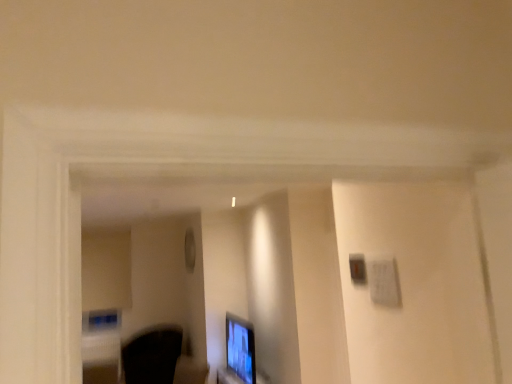
Question: From the image's perspective, is matte black monitor at lower center located above or below black fabric swivel chair at lower left?

Choices:
 (A) below
 (B) above

Answer: (B)

Question: Which is correct: matte black monitor at lower center is inside black fabric swivel chair at lower left, or outside of it?

Choices:
 (A) outside
 (B) inside

Answer: (A)

Question: Is matte black monitor at lower center taller or shorter than black fabric swivel chair at lower left?

Choices:
 (A) tall
 (B) short

Answer: (A)

Question: Is black fabric swivel chair at lower left in front of or behind matte black monitor at lower center in the image?

Choices:
 (A) front
 (B) behind

Answer: (B)

Question: Considering the positions of black fabric swivel chair at lower left and matte black monitor at lower center in the image, is black fabric swivel chair at lower left wider or thinner than matte black monitor at lower center?

Choices:
 (A) thin
 (B) wide

Answer: (B)

Question: From the image's perspective, is black fabric swivel chair at lower left above or below matte black monitor at lower center?

Choices:
 (A) above
 (B) below

Answer: (B)

Question: Is black fabric swivel chair at lower left bigger or smaller than matte black monitor at lower center?

Choices:
 (A) small
 (B) big

Answer: (B)